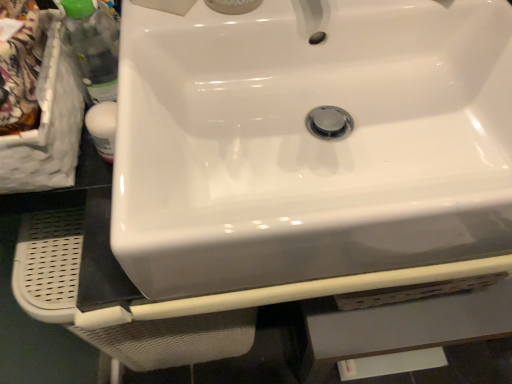
Question: Does point (117, 31) appear closer or farther from the camera than point (392, 114)?

Choices:
 (A) closer
 (B) farther

Answer: (B)

Question: Considering the positions of translucent plastic bottle at left and white glossy sink at center in the image, is translucent plastic bottle at left bigger or smaller than white glossy sink at center?

Choices:
 (A) small
 (B) big

Answer: (A)

Question: From their relative heights in the image, would you say translucent plastic bottle at left is taller or shorter than white glossy sink at center?

Choices:
 (A) tall
 (B) short

Answer: (A)

Question: From the image's perspective, is white glossy sink at center above or below translucent plastic bottle at left?

Choices:
 (A) below
 (B) above

Answer: (A)

Question: Considering the positions of point (273, 195) and point (69, 9), is point (273, 195) closer or farther from the camera than point (69, 9)?

Choices:
 (A) closer
 (B) farther

Answer: (A)

Question: Considering the positions of white glossy sink at center and translucent plastic bottle at left in the image, is white glossy sink at center wider or thinner than translucent plastic bottle at left?

Choices:
 (A) wide
 (B) thin

Answer: (A)

Question: Looking at the image, does white glossy sink at center seem bigger or smaller compared to translucent plastic bottle at left?

Choices:
 (A) big
 (B) small

Answer: (A)